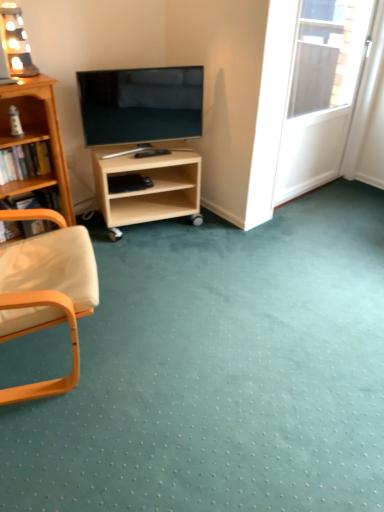
Where is `vacant area located to the right-hand side of light wood/unfinishedobject at center`? This screenshot has height=512, width=384. vacant area located to the right-hand side of light wood/unfinishedobject at center is located at coordinates (227, 234).